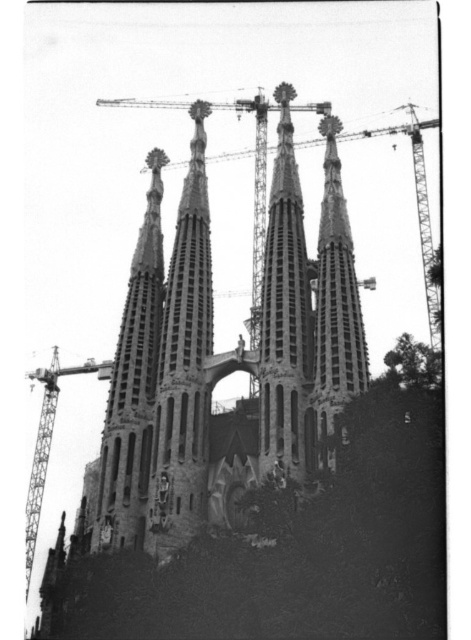
Who is shorter, dark gray stone tower at center or smooth stone tower at center?

smooth stone tower at center

Which is more to the left, dark gray stone tower at center or smooth stone tower at center?

dark gray stone tower at center

Between point (183, 292) and point (259, 406), which one is positioned in front?

Point (259, 406) is more forward.

I want to click on dark gray stone tower at center, so click(x=184, y=365).

Does point (300, 387) lie behind point (424, 280)?

No, (300, 387) is in front of (424, 280).

Who is positioned more to the right, smooth stone tower at center or metallic construction crane at center?

From the viewer's perspective, metallic construction crane at center appears more on the right side.

Locate an element on the screen. smooth stone tower at center is located at coordinates (284, 314).

Between point (317, 464) and point (260, 392), which one is positioned behind?

The point (260, 392) is more distant.

Is stone church at center shorter than smooth stone tower at center?

No.

Locate an element on the screen. The height and width of the screenshot is (640, 471). stone church at center is located at coordinates (227, 356).